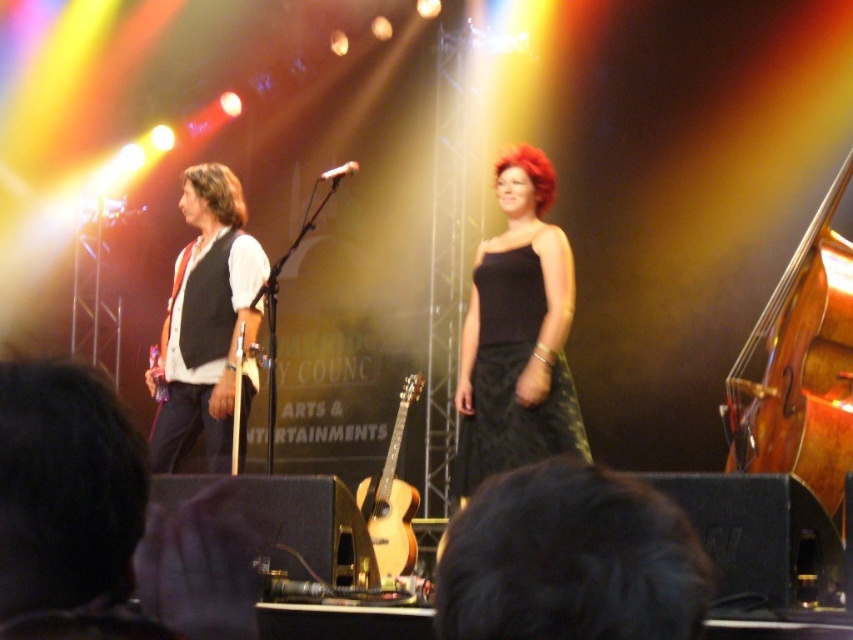
You are a stagehand who needs to place a new stand for the wooden acoustic guitar at left and the silver metallic microphone at center. Which object requires a wider stand?

The wooden acoustic guitar at left requires a wider stand because its width is larger than the silver metallic microphone at center.

You are a stagehand who needs to move the wooden polished cello at right and the brown wavy hair at left to the backstage. Which object should you move first to avoid blocking the path of the other?

You should move the brown wavy hair at left first because the wooden polished cello at right is to the right of it. Moving the cello first would block the path to the hair.